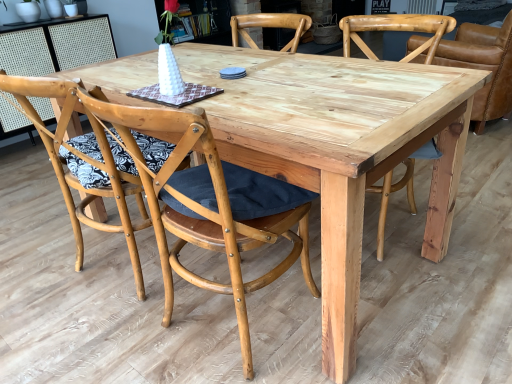
Question: Is natural wood chair at center, which ranks as the second chair in right-to-left order, bigger or smaller than natural wood chair at center, the 2th chair from the left?

Choices:
 (A) big
 (B) small

Answer: (A)

Question: Considering their positions, is natural wood chair at center, marked as the third chair in a left-to-right arrangement, located in front of or behind natural wood chair at center, the 2th chair from the left?

Choices:
 (A) behind
 (B) front

Answer: (A)

Question: Which object is positioned farthest from the natural wood chair at center, acting as the third chair starting from the right?

Choices:
 (A) natural wood chair at right, the first chair viewed from the right
 (B) natural wood chair at center, which ranks as the second chair in right-to-left order
 (C) natural wood chair at center, which ranks as the first chair in left-to-right order

Answer: (A)

Question: Which object is positioned closest to the natural wood chair at center, acting as the third chair starting from the right?

Choices:
 (A) natural wood chair at right, the first chair viewed from the right
 (B) natural wood chair at center, which is the 4th chair in right-to-left order
 (C) natural wood chair at center, marked as the third chair in a left-to-right arrangement

Answer: (B)